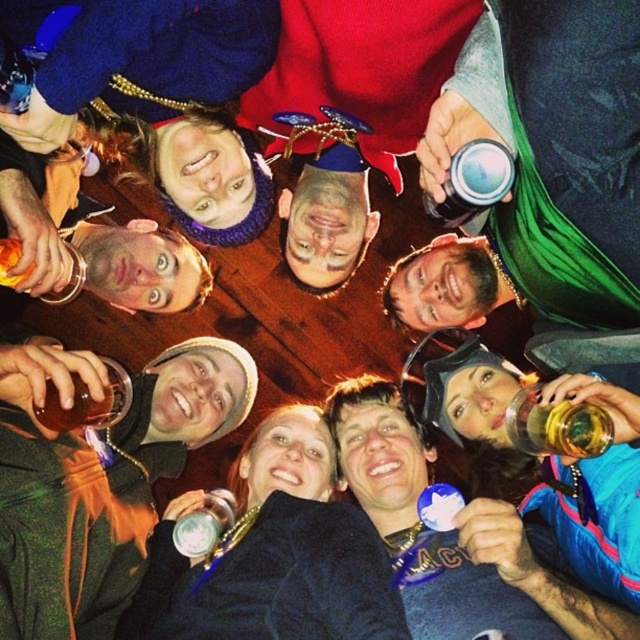
Who is more distant from viewer, (35,548) or (573,552)?

Positioned behind is point (573,552).

The width and height of the screenshot is (640, 640). I want to click on green fabric hat at upper center, so click(x=97, y=477).

Between green fabric hat at upper center and brown glass bottle at center, which one appears on the right side from the viewer's perspective?

green fabric hat at upper center

At what (x,y) coordinates should I click in order to perform the action: click on green fabric hat at upper center. Please return your answer as a coordinate pair (x, y). Looking at the image, I should click on (97, 477).

At what (x,y) coordinates should I click in order to perform the action: click on green fabric hat at upper center. Please return your answer as a coordinate pair (x, y). Looking at the image, I should click on (97, 477).

Is point (612, 493) closer to camera compared to point (58, 432)?

Yes.

Is matte black jacket at lower right below brown glass bottle at center?

Indeed, matte black jacket at lower right is positioned under brown glass bottle at center.

Measure the distance between point (624, 547) and camera.

The distance of point (624, 547) from camera is 1.12 meters.

Where is `matte black jacket at lower right`? matte black jacket at lower right is located at coordinates (548, 452).